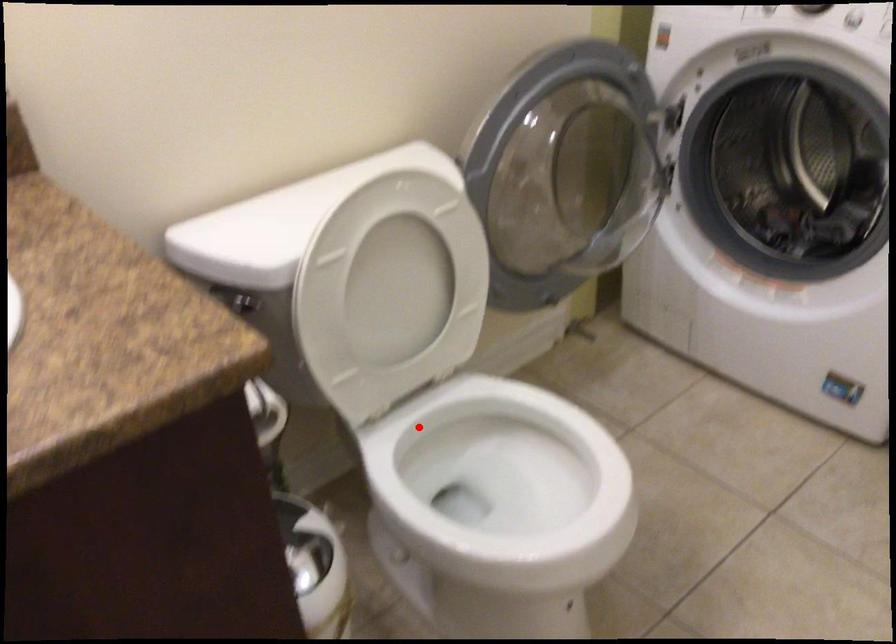
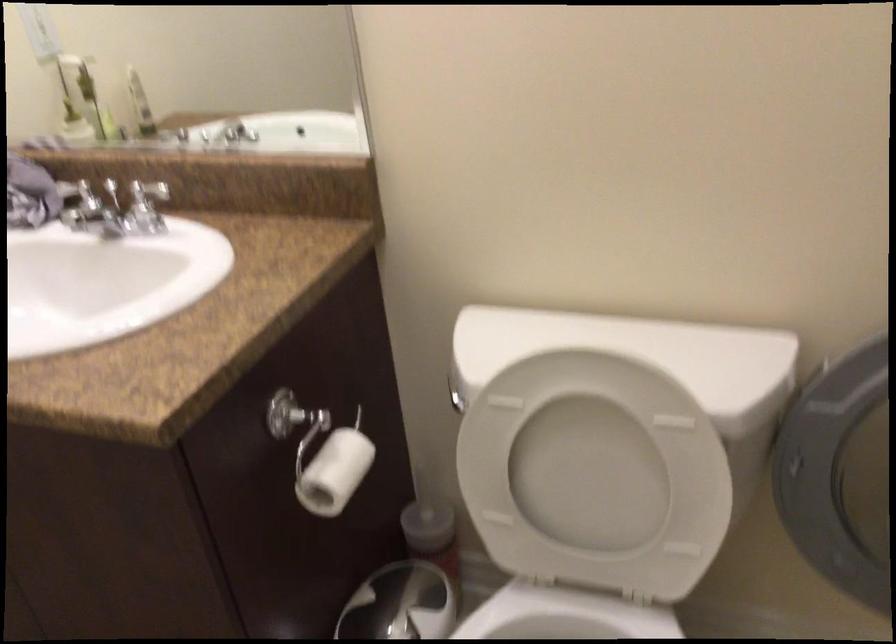
Question: I am providing you with two images of the same scene from different viewpoints. In image1, a red point is highlighted. Considering the same 3D point in image2, which of the following is correct?

Choices:
 (A) It is closer
 (B) It is farther

Answer: (A)